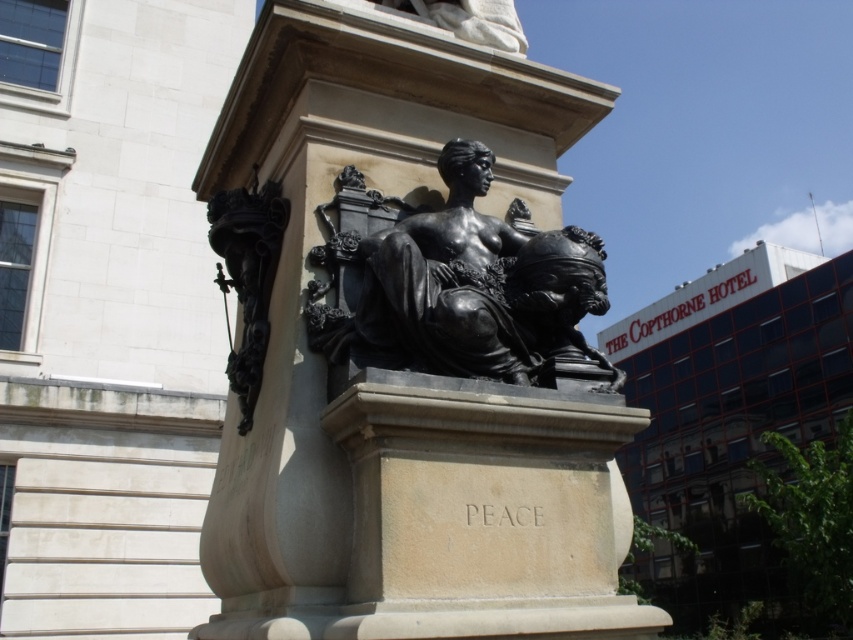
Which is below, bronze statue at center or black polished statue at center?

bronze statue at center

Is point (265, 564) behind point (407, 324)?

No.

Where is `bronze statue at center`? Image resolution: width=853 pixels, height=640 pixels. bronze statue at center is located at coordinates click(409, 344).